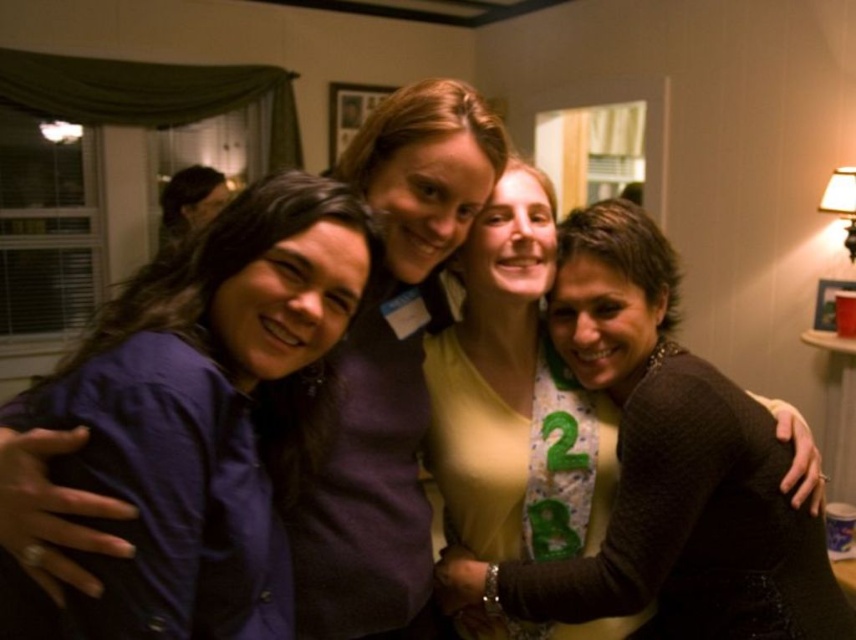
Between dark blue shirt at left and matte brown sweater at center, which one appears on the left side from the viewer's perspective?

Positioned to the left is dark blue shirt at left.

Is dark blue shirt at left to the right of matte brown sweater at center from the viewer's perspective?

In fact, dark blue shirt at left is to the left of matte brown sweater at center.

Locate an element on the screen. The width and height of the screenshot is (856, 640). dark blue shirt at left is located at coordinates (205, 419).